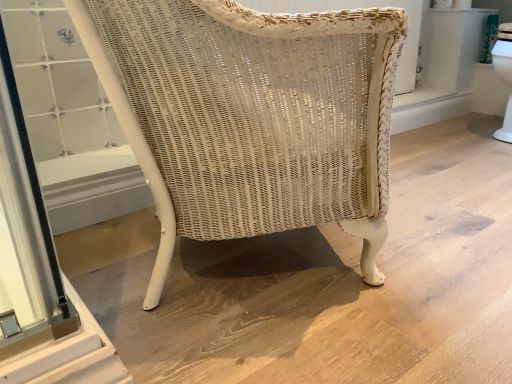
Find the location of `vacant space underneath white wicker chair at center (from a real-world perspective)`. vacant space underneath white wicker chair at center (from a real-world perspective) is located at coordinates (220, 268).